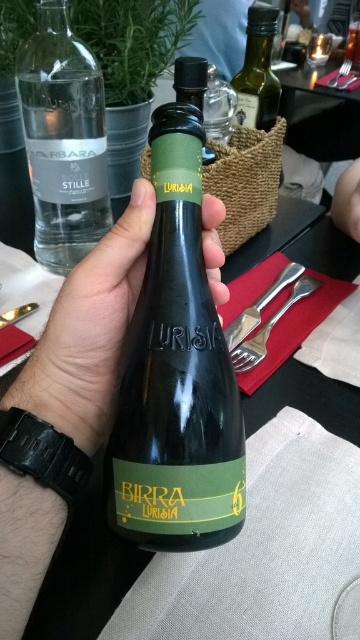
You are a waiter at a restaurant and need to place a napkin under the green matte bottle at center. However, there is a satin silver fork at lower right in the way. Can you slide the napkin under the bottle without moving the fork?

The satin silver fork at lower right is further to the viewer than the green matte bottle at center, so the fork is closer to you. This means the bottle is behind the fork. To place the napkin under the bottle, you would need to move the fork out of the way first because it is blocking access to the bottle.

You are setting up a table for a dinner party and need to place a metallic silver fork at upper center. Where should you place it relative to the green matte bottle at center?

The metallic silver fork at upper center should be placed above the green matte bottle at center since the green matte bottle at center is positioned under the metallic silver fork at upper center.

You are looking at the table setup in the image. There are two points marked on the table surface. The first point is at coordinates point [168,312] and the second is at point [339,68]. Which of these two points is closer to you?

Point [168,312] is closer to the viewer than point [339,68].